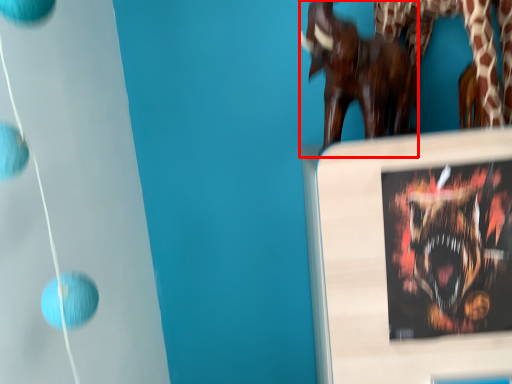
Question: In this image, where is sculpture (annotated by the red box) located relative to animal?

Choices:
 (A) right
 (B) left

Answer: (B)